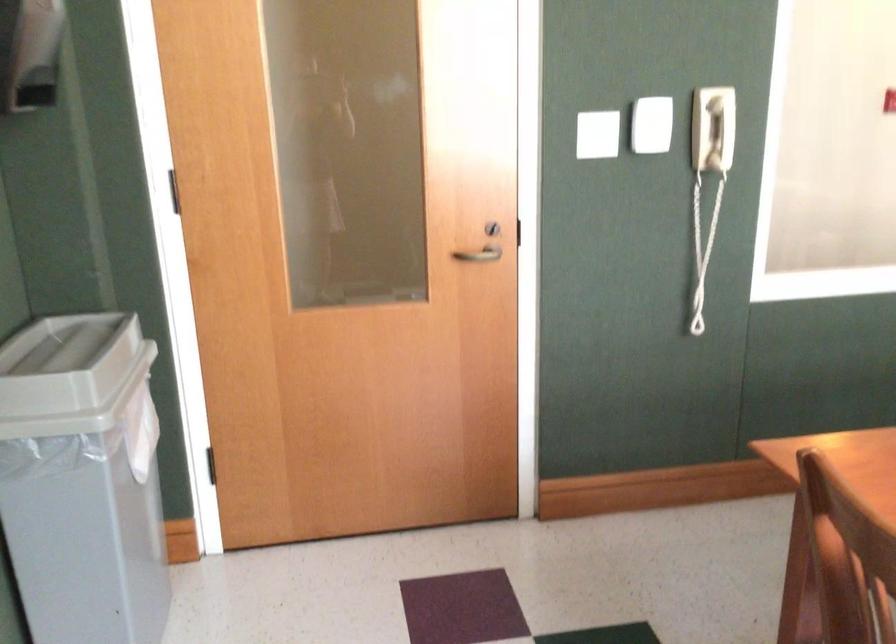
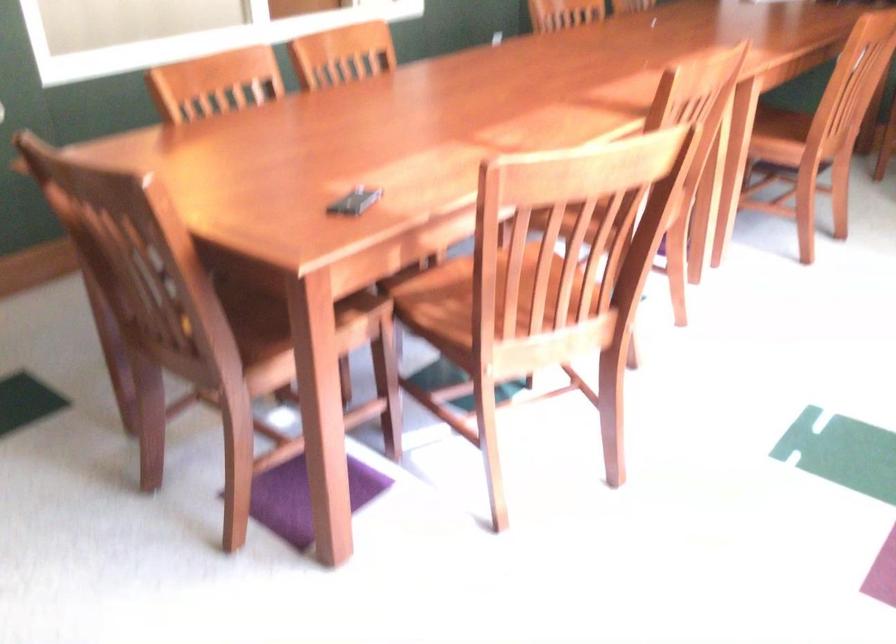
Question: Based on the continuous images, in which direction is the camera rotating? Reply with the corresponding letter.

Choices:
 (A) Left
 (B) Right
 (C) Up
 (D) Down

Answer: (B)